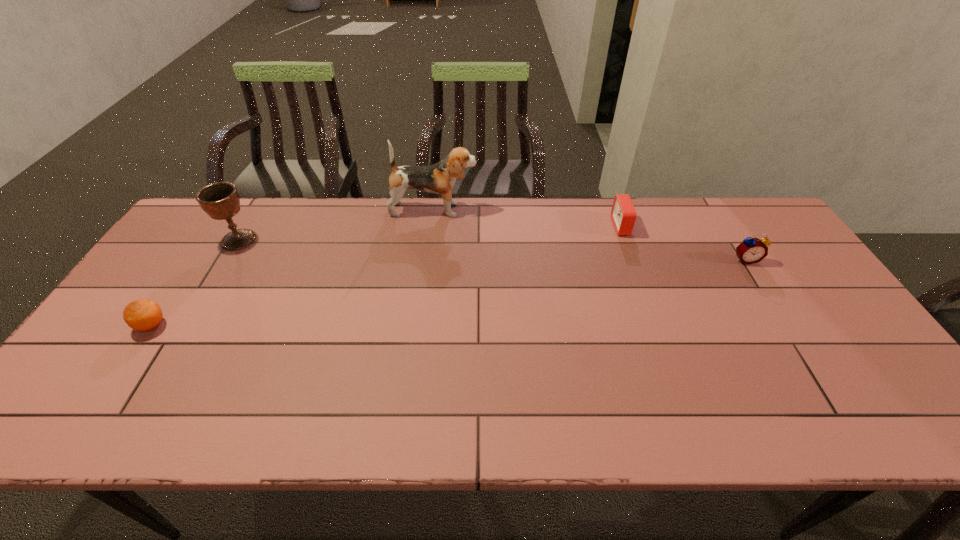
Find the location of `the third object from left to right`. the third object from left to right is located at coordinates (439, 178).

Identify the location of puppy. (439, 178).

At what (x,y) coordinates should I click in order to perform the action: click on chalice. Please return your answer as a coordinate pair (x, y). This screenshot has width=960, height=540. Looking at the image, I should click on (220, 200).

Find the location of a particular element. The height and width of the screenshot is (540, 960). the third tallest object is located at coordinates (752, 250).

Find the location of a particular element. the taller alarm clock is located at coordinates [752, 250].

Locate an element on the screen. the shorter alarm clock is located at coordinates pos(623,214).

Locate an element on the screen. the farther alarm clock is located at coordinates (623, 214).

Locate an element on the screen. This screenshot has width=960, height=540. orange is located at coordinates (143, 315).

This screenshot has height=540, width=960. Identify the location of free space located 0.080m at the face of the puppy. (502, 210).

You are a GUI agent. You are given a task and a screenshot of the screen. Output one action in this format:
    pyautogui.click(x=<x>, y=<y>)
    Task: Click on the free space located 0.330m on the right of the second tallest object
    The height and width of the screenshot is (540, 960).
    Given the screenshot: What is the action you would take?
    pyautogui.click(x=362, y=240)